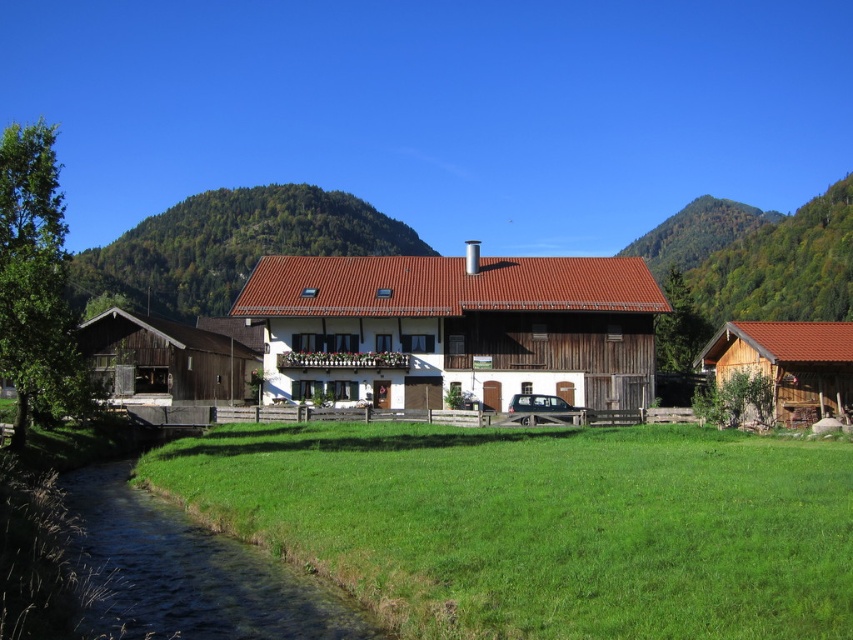
Is green grass at lower left taller than white wooden house at center?

No, green grass at lower left is not taller than white wooden house at center.

Can you confirm if green grass at lower left is wider than white wooden house at center?

In fact, green grass at lower left might be narrower than white wooden house at center.

Locate an element on the screen. The width and height of the screenshot is (853, 640). green grass at lower left is located at coordinates (540, 524).

Is clear water at lower left bigger than brown wooden hut at lower right?

Incorrect, clear water at lower left is not larger than brown wooden hut at lower right.

Who is more forward, (218, 625) or (715, 374)?

Point (218, 625) is in front.

Identify the location of clear water at lower left. The width and height of the screenshot is (853, 640). (193, 572).

Is green grassy hillside at upper center to the left of brown wooden hut at lower right from the viewer's perspective?

Indeed, green grassy hillside at upper center is positioned on the left side of brown wooden hut at lower right.

Between point (167, 262) and point (730, 371), which one is positioned behind?

The point (167, 262) is more distant.

Image resolution: width=853 pixels, height=640 pixels. What are the coordinates of `green grassy hillside at upper center` in the screenshot? It's located at (230, 246).